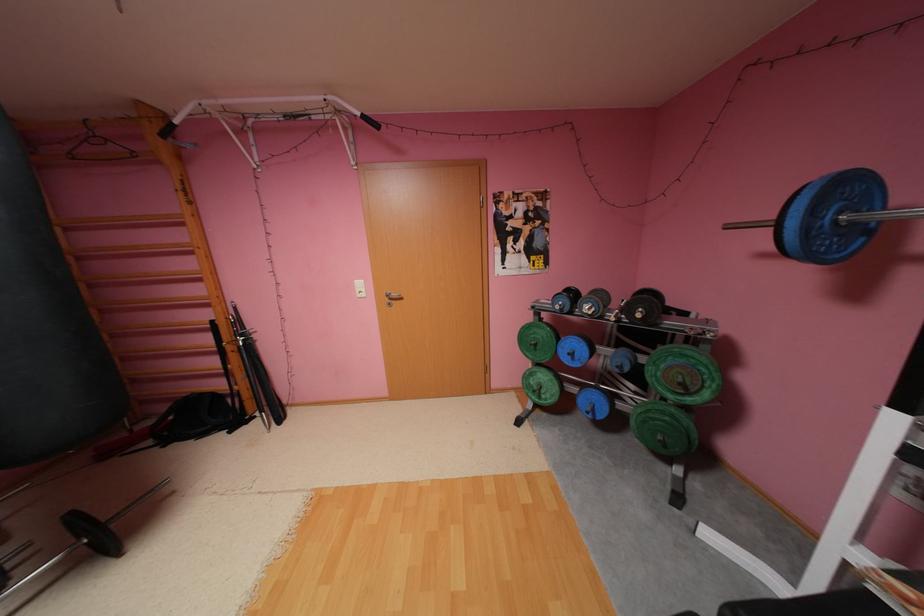
The width and height of the screenshot is (924, 616). Describe the element at coordinates (239, 365) in the screenshot. I see `the sword hilt` at that location.